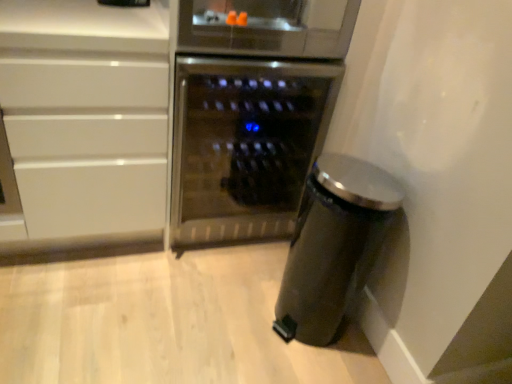
Identify the location of free space in front of satin black trash can at lower right. This screenshot has height=384, width=512. (295, 367).